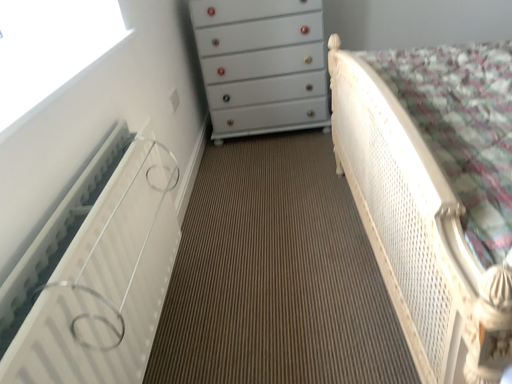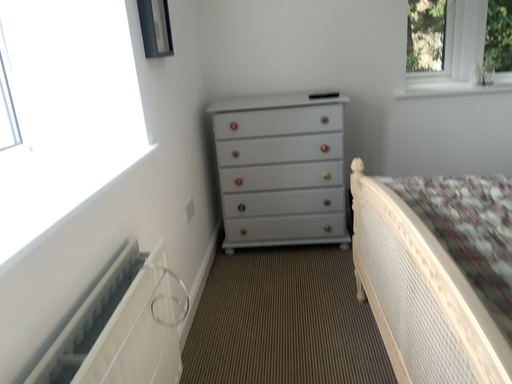
Question: How did the camera likely rotate when shooting the video?

Choices:
 (A) rotated upward
 (B) rotated downward

Answer: (A)